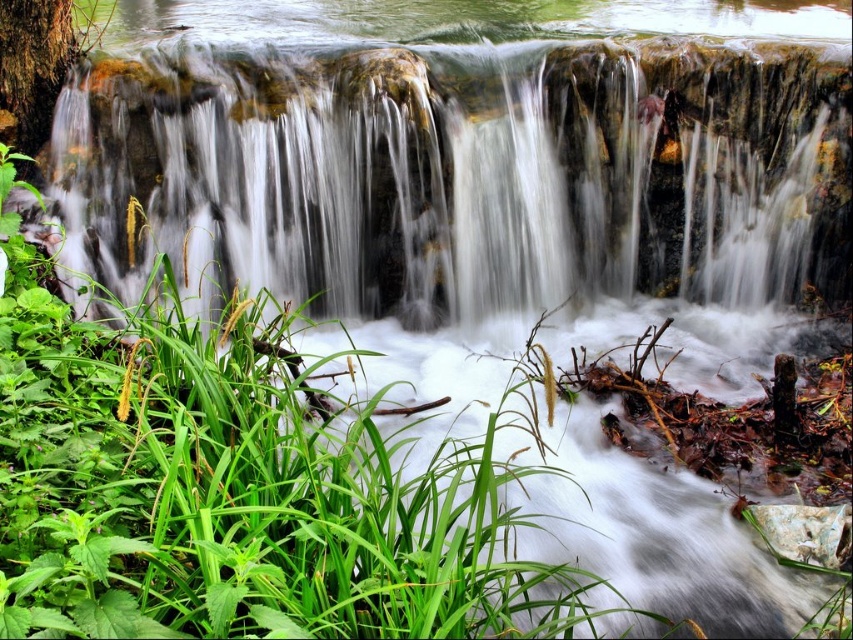
Question: Is translucent stone waterfall at upper center bigger than green leafy grass at center?

Choices:
 (A) yes
 (B) no

Answer: (B)

Question: Which of the following is the closest to the observer?

Choices:
 (A) green leafy grass at center
 (B) translucent stone waterfall at upper center

Answer: (A)

Question: Is translucent stone waterfall at upper center further to the viewer compared to green leafy grass at center?

Choices:
 (A) yes
 (B) no

Answer: (A)

Question: Is the position of translucent stone waterfall at upper center less distant than that of green leafy grass at center?

Choices:
 (A) yes
 (B) no

Answer: (B)